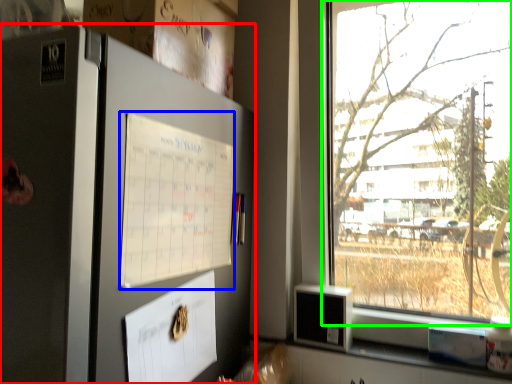
Question: Based on their relative distances, which object is nearer to fridge (highlighted by a red box)? Choose from poster (highlighted by a blue box) and window (highlighted by a green box).

Choices:
 (A) poster
 (B) window

Answer: (A)